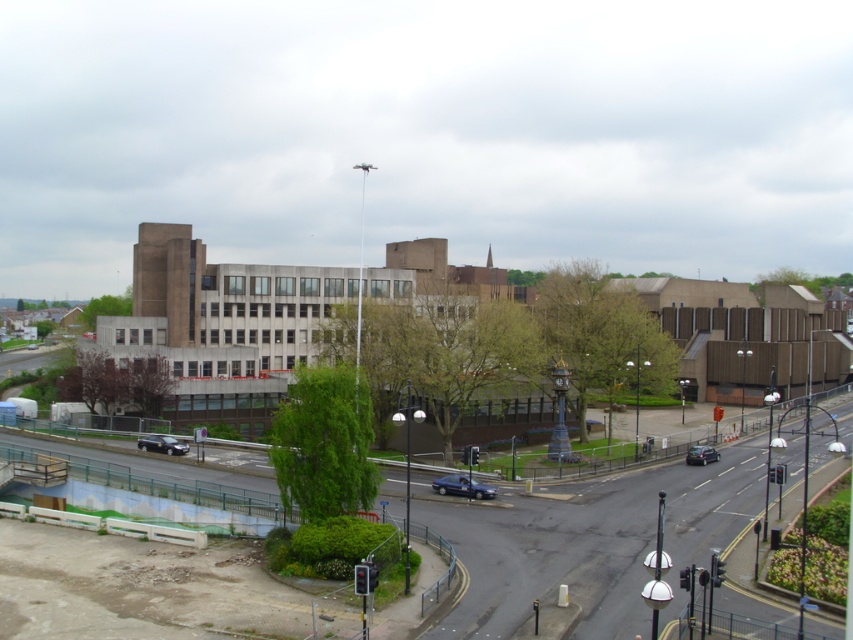
Question: Which of the following is the closest to the observer?

Choices:
 (A) (148, 444)
 (B) (437, 492)
 (C) (695, 464)

Answer: (B)

Question: Is shiny black sedan at lower left further to the viewer compared to shiny black sedan at lower right?

Choices:
 (A) yes
 (B) no

Answer: (A)

Question: Which object is farther from the camera taking this photo?

Choices:
 (A) shiny black sedan at lower right
 (B) metallic blue sedan at center
 (C) shiny black sedan at lower left

Answer: (C)

Question: Is metallic blue sedan at center to the left of shiny black sedan at lower right from the viewer's perspective?

Choices:
 (A) no
 (B) yes

Answer: (B)

Question: Considering the real-world distances, which object is closest to the shiny black sedan at lower right?

Choices:
 (A) metallic blue sedan at center
 (B) shiny black sedan at lower left

Answer: (A)

Question: Is metallic blue sedan at center to the right of shiny black sedan at lower left from the viewer's perspective?

Choices:
 (A) yes
 (B) no

Answer: (A)